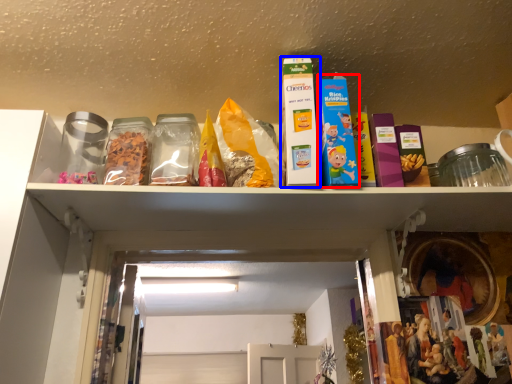
Question: Among these objects, which one is nearest to the camera, product (highlighted by a red box) or product (highlighted by a blue box)?

Choices:
 (A) product
 (B) product

Answer: (B)